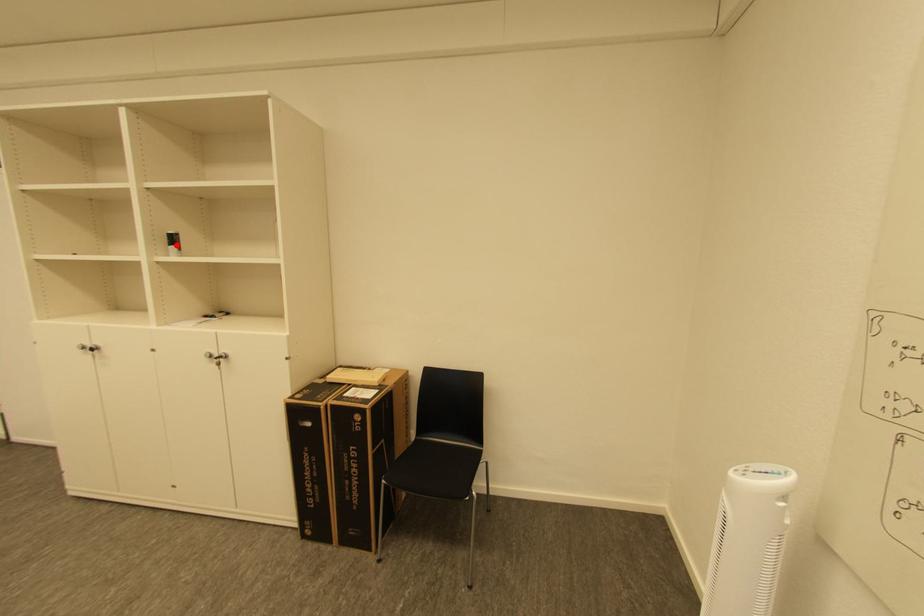
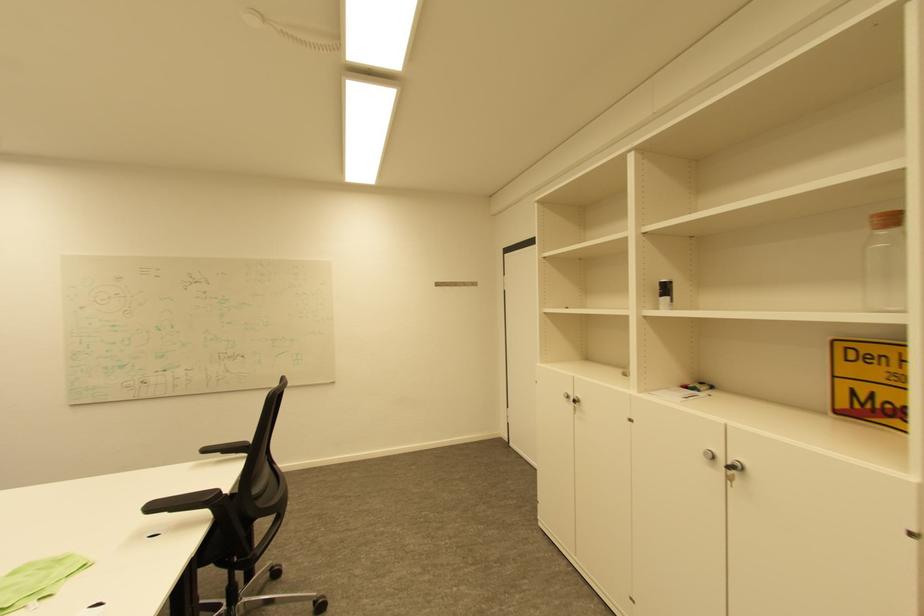
Where in the second image is the point corresponding to the highlighted location from the first image?

(667, 296)